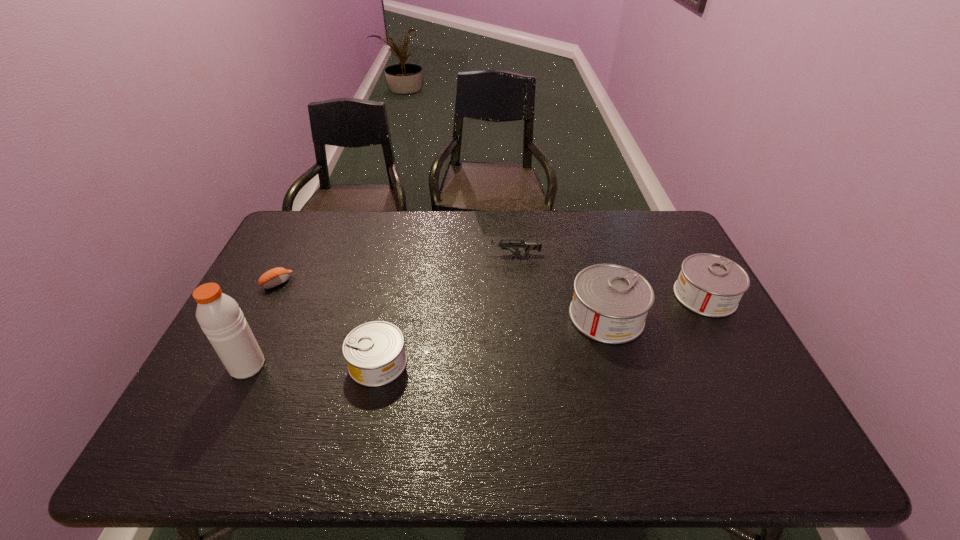
Identify the location of the third object from left to right. (374, 351).

This screenshot has height=540, width=960. What are the coordinates of `the leftmost can` in the screenshot? It's located at (374, 351).

This screenshot has width=960, height=540. I want to click on the second can from left to right, so [x=610, y=303].

This screenshot has height=540, width=960. What are the coordinates of `the second tallest can` in the screenshot? It's located at (710, 285).

Locate an element on the screen. This screenshot has height=540, width=960. the rightmost can is located at coordinates (710, 285).

The height and width of the screenshot is (540, 960). In order to click on gun in this screenshot , I will do [527, 247].

Where is `the farthest object`? This screenshot has height=540, width=960. the farthest object is located at coordinates (527, 247).

At what (x,y) coordinates should I click in order to perform the action: click on the shortest object. Please return your answer as a coordinate pair (x, y). This screenshot has height=540, width=960. Looking at the image, I should click on (276, 276).

The width and height of the screenshot is (960, 540). Find the location of `shaker`. shaker is located at coordinates (219, 316).

The width and height of the screenshot is (960, 540). Identify the location of vacant space positioned 0.190m on the right of the fourth object from right to left. (482, 362).